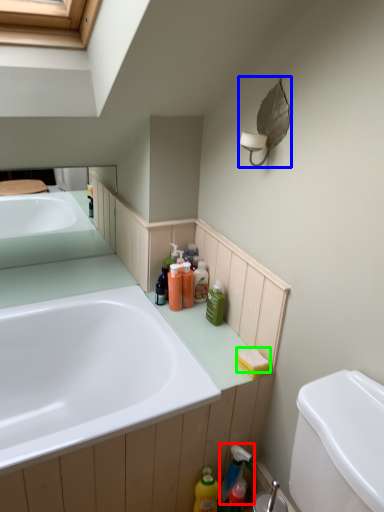
Question: Considering the real-world distances, which object is farthest from cleaning product (highlighted by a red box)? light fixture (highlighted by a blue box) or soap (highlighted by a green box)?

Choices:
 (A) light fixture
 (B) soap

Answer: (A)